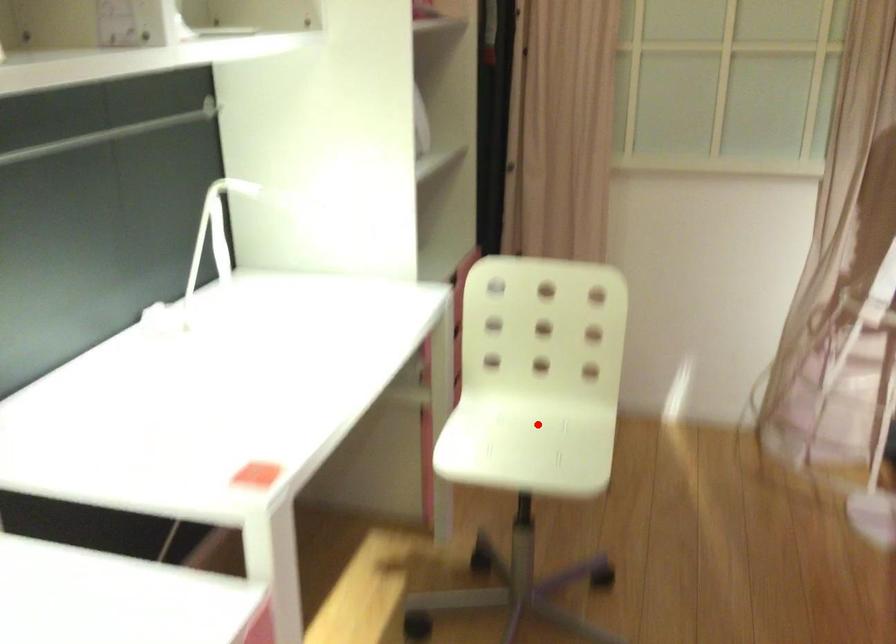
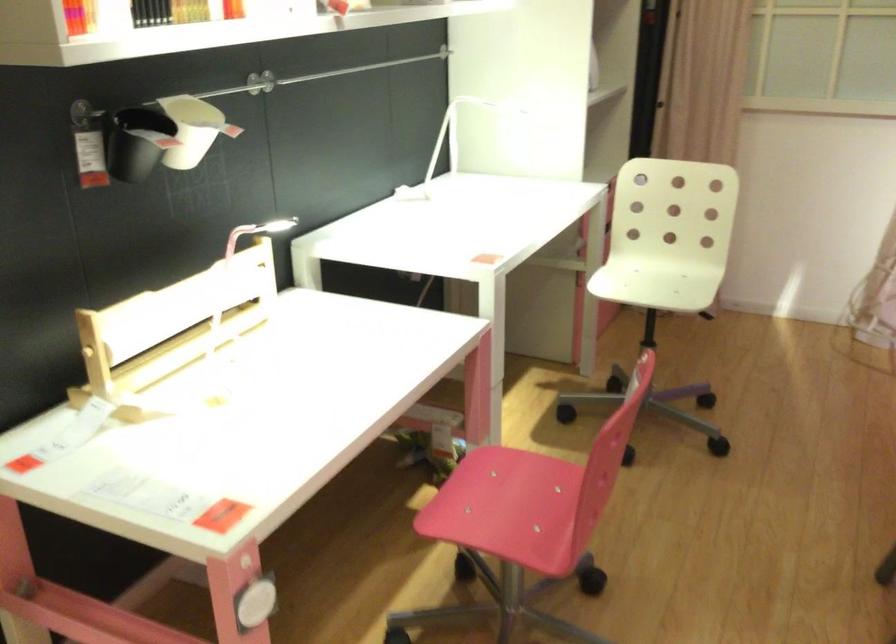
Question: I am providing you with two images of the same scene from different viewpoints. A red point is shown in image1. For the corresponding object point in image2, is it positioned nearer or farther from the camera?

Choices:
 (A) Nearer
 (B) Farther

Answer: (B)